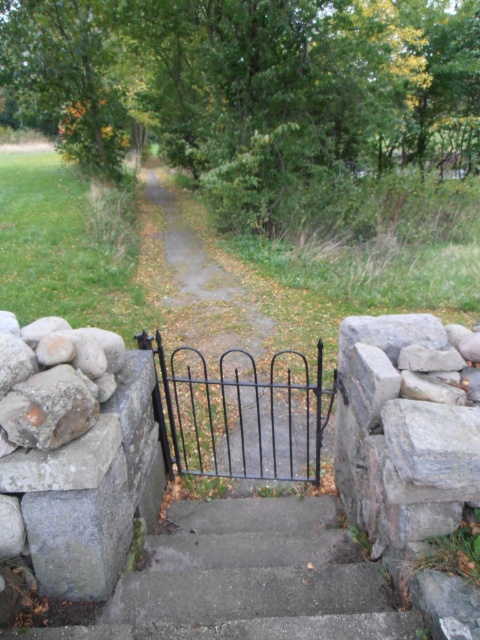
You are standing at the bottom of the concrete steps bordered by a rustic stone wall. You see two gates ahead, a black metal gate at center and a black wrought iron gate at center. Which gate is positioned higher up the steps?

The black metal gate at center is located above the black wrought iron gate at center, so the black metal gate at center is positioned higher up the steps.

You are standing at the bottom of the steps and want to walk towards the black metal gate at center. Which direction should you go relative to the gray rough stone at right?

You should walk towards the left of the gray rough stone at right because the black metal gate at center is located above it.

You are a delivery person carrying a heavy box and need to climb the concrete stairs at center and pass through the black metal gate at center. Considering their heights, which one do you need to look up to more when approaching them?

The black metal gate at center is taller than the concrete stairs at center, so you would need to look up more when approaching the black metal gate at center.